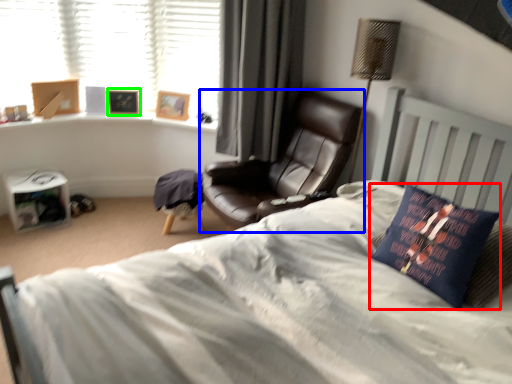
Question: Which object is positioned farthest from pillow (highlighted by a red box)? Select from chair (highlighted by a blue box) and picture frame (highlighted by a green box).

Choices:
 (A) chair
 (B) picture frame

Answer: (B)